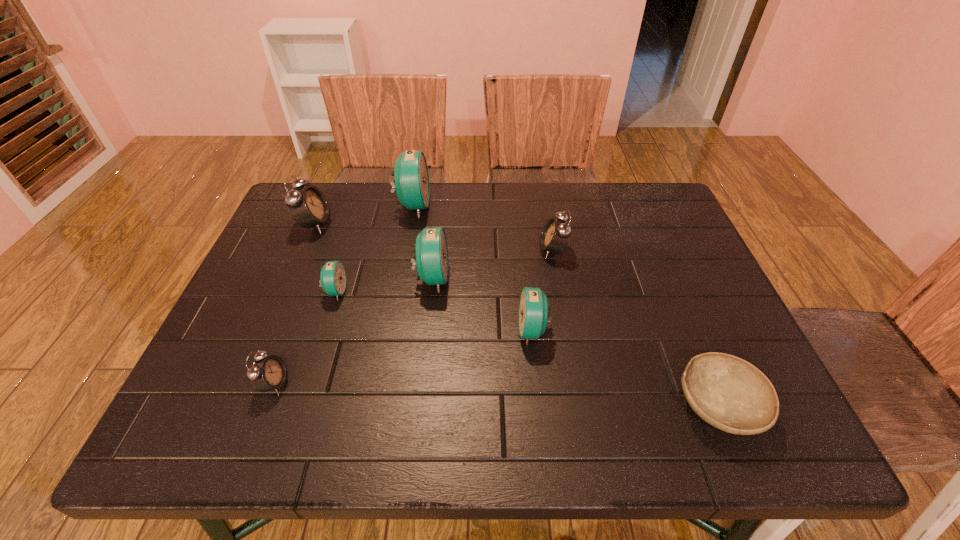
At what (x,y) coordinates should I click in order to perform the action: click on the nearest white alarm clock. Please return your answer as a coordinate pair (x, y). Looking at the image, I should click on (269, 373).

Where is `the nearest alarm clock`? The width and height of the screenshot is (960, 540). the nearest alarm clock is located at coordinates (269, 373).

Identify the location of the rightmost object. (729, 393).

The width and height of the screenshot is (960, 540). I want to click on bowl, so click(x=729, y=393).

The image size is (960, 540). I want to click on vacant space located 0.200m on the front-facing side of the tallest object, so click(x=497, y=206).

You are a GUI agent. You are given a task and a screenshot of the screen. Output one action in this format:
    pyautogui.click(x=<x>, y=<y>)
    Task: Click on the free spot located 0.060m on the face of the biggest white alarm clock
    Image resolution: width=960 pixels, height=540 pixels.
    Given the screenshot: What is the action you would take?
    pyautogui.click(x=352, y=224)

This screenshot has width=960, height=540. I want to click on free region located on the front-facing side of the third smallest blue alarm clock, so click(589, 278).

This screenshot has height=540, width=960. What are the coordinates of `blank space located 0.280m on the face of the seventh object from left to right` in the screenshot? It's located at (434, 250).

Where is `free space located on the face of the seventh object from left to right`? free space located on the face of the seventh object from left to right is located at coordinates (479, 250).

You are a GUI agent. You are given a task and a screenshot of the screen. Output one action in this format:
    pyautogui.click(x=<x>, y=<y>)
    Task: Click on the free region located on the face of the seventh object from left to right
    The width and height of the screenshot is (960, 540).
    Given the screenshot: What is the action you would take?
    pyautogui.click(x=456, y=250)